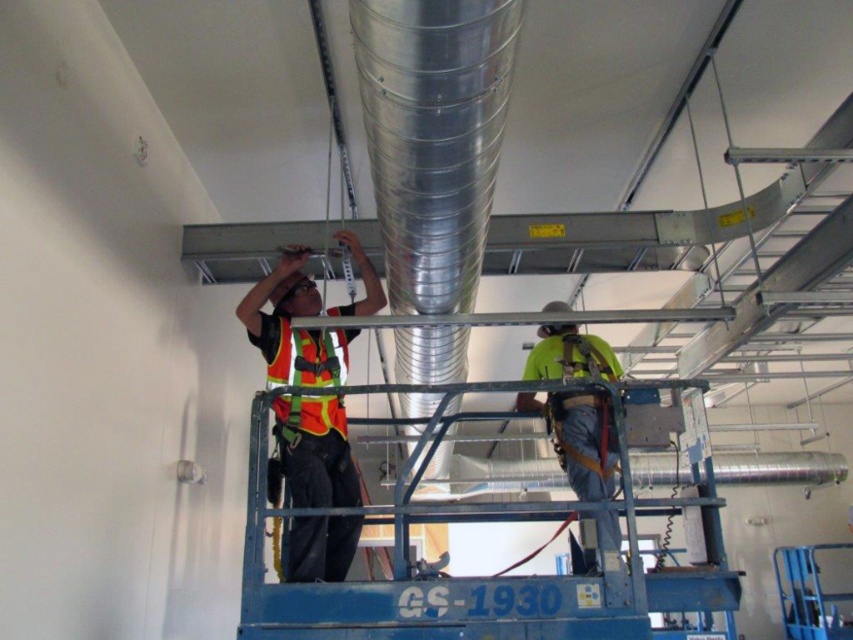
Please provide the coordinates of the reflective orange safety vest at center in the image.

The reflective orange safety vest at center is located at coordinates point (x=293, y=326).